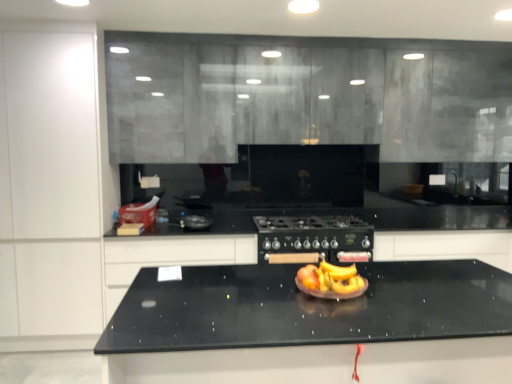
In order to click on vacant area located to the right-hand side of shiny plastic fruit bowl at center in this screenshot , I will do `click(403, 288)`.